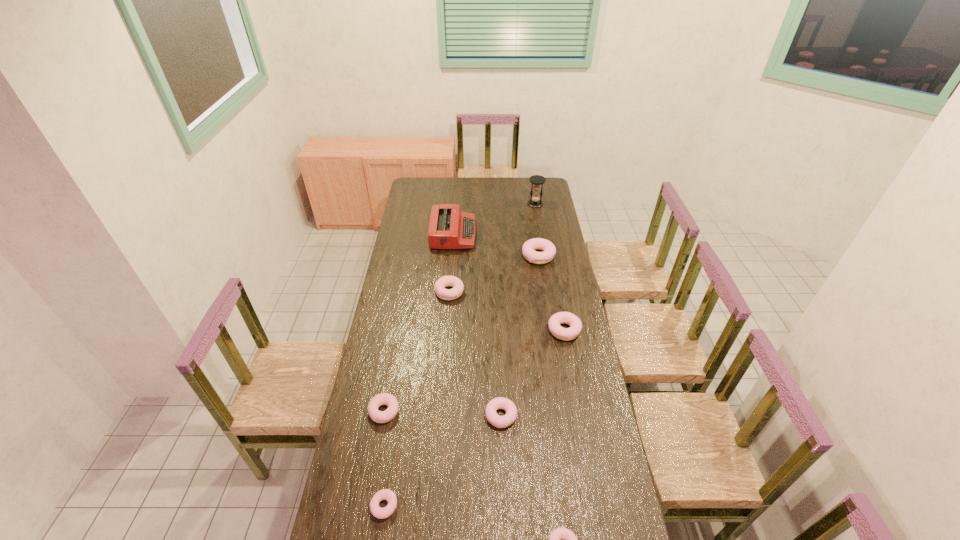
Identify the location of the second smallest purple doughnut. (387, 399).

Locate an element on the screen. the leftmost pink doughnut is located at coordinates (503, 403).

Identify the location of the third biggest pink doughnut. (503, 403).

Find the location of a particular element. The image size is (960, 540). the smallest purple doughnut is located at coordinates (385, 494).

This screenshot has width=960, height=540. Find the location of `the second nearest object`. the second nearest object is located at coordinates (385, 494).

The height and width of the screenshot is (540, 960). I want to click on free space located on the left of the farthest object, so click(482, 204).

Find the location of a particular element. This screenshot has height=540, width=960. vacant region located 0.170m on the typing side of the eighth shortest object is located at coordinates (505, 234).

Find the location of a particular element. free space located on the back of the biggest pink doughnut is located at coordinates (534, 230).

At what (x,y) coordinates should I click in order to perform the action: click on vacant space situated on the left of the sixth nearest object. Please return your answer as a coordinate pair (x, y). Looking at the image, I should click on (401, 292).

This screenshot has height=540, width=960. Find the location of `vacant region located 0.080m on the left of the third smallest pink doughnut`. vacant region located 0.080m on the left of the third smallest pink doughnut is located at coordinates (530, 330).